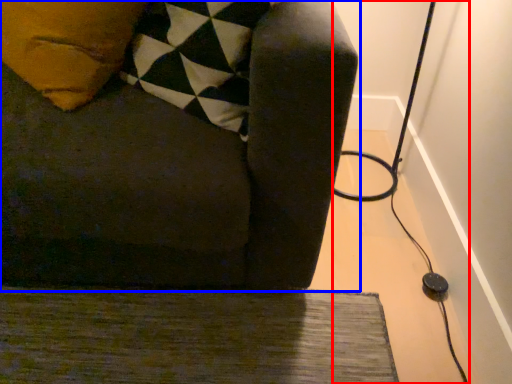
Question: Which of the following is the farthest to the observer, cable (highlighted by a red box) or furniture (highlighted by a blue box)?

Choices:
 (A) cable
 (B) furniture

Answer: (A)